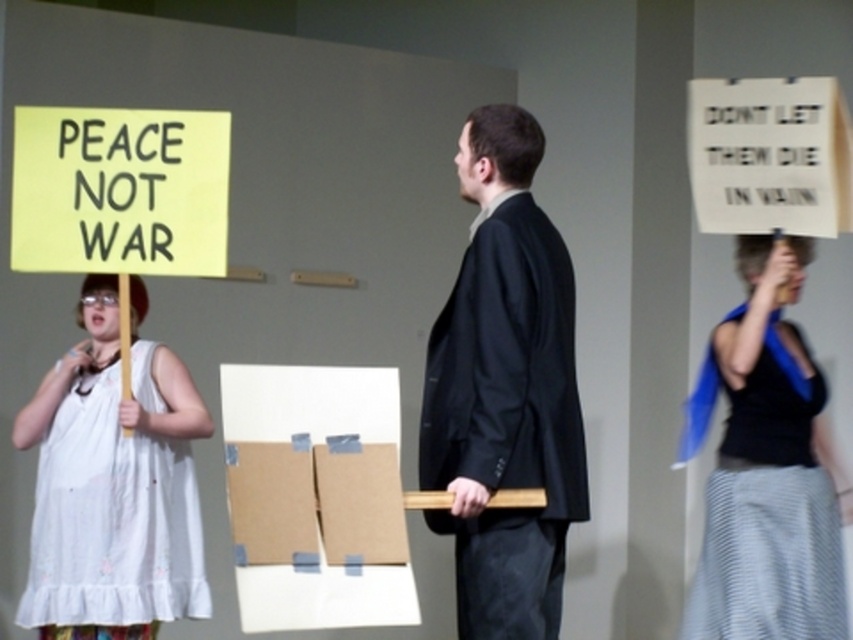
Based on the photo, you are observing a staged scene with a black matte tank top at right and a white cotton dress at left. Based on their positions, which clothing item is positioned higher relative to the other?

The black matte tank top at right is located above the white cotton dress at left, so it is positioned higher.

You are an observer standing in front of the scene. You notice the black matte tank top at right and the white cotton dress at left. Which clothing item appears narrower when viewed from your perspective?

The black matte tank top at right has a lesser width compared to the white cotton dress at left, so the black matte tank top at right appears narrower.

You are a photographer setting up for a group photo. You notice the black smooth suit at center and the yellow paper sign at left. Which object should you adjust to ensure both are in focus if the depth of field is limited?

The black smooth suit at center is taller than the yellow paper sign at left, so adjusting the focus on the black smooth suit at center would ensure both are in focus due to its greater height.